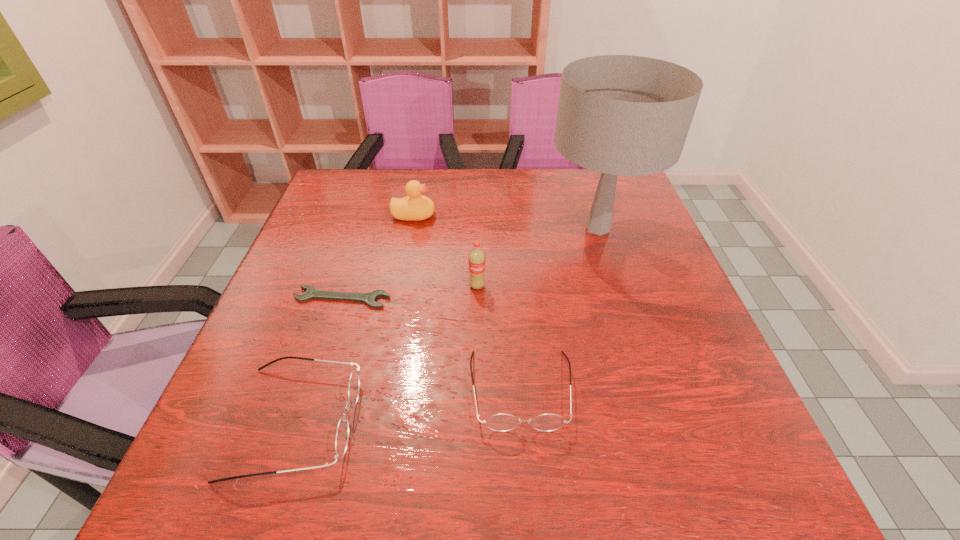
I want to click on object at the far right corner, so click(627, 115).

This screenshot has height=540, width=960. I want to click on vacant space at the far edge of the desktop, so click(384, 209).

Locate an element on the screen. vacant space at the near edge is located at coordinates (530, 409).

What are the coordinates of `blank space at the left edge` in the screenshot? It's located at (262, 333).

Locate an element on the screen. The image size is (960, 540). vacant space at the right edge of the desktop is located at coordinates (x=629, y=266).

This screenshot has height=540, width=960. In the image, there is a desktop. Find the location of `vacant area at the far left corner`. vacant area at the far left corner is located at coordinates (363, 195).

Locate an element on the screen. vacant space at the near left corner of the desktop is located at coordinates pyautogui.click(x=309, y=409).

Find the location of a particular element. free space at the far right corner of the desktop is located at coordinates (595, 176).

Identify the location of empty space that is in between the soda and the rightmost object. (538, 257).

I want to click on empty space that is in between the duck and the tallest object, so click(x=506, y=222).